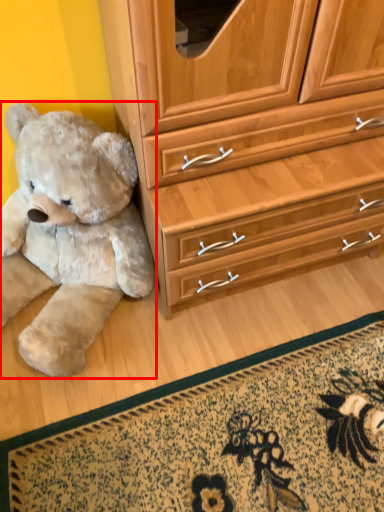
Question: Observing the image, what is the correct spatial positioning of teddy bear (annotated by the red box) in reference to doormat?

Choices:
 (A) right
 (B) left

Answer: (B)